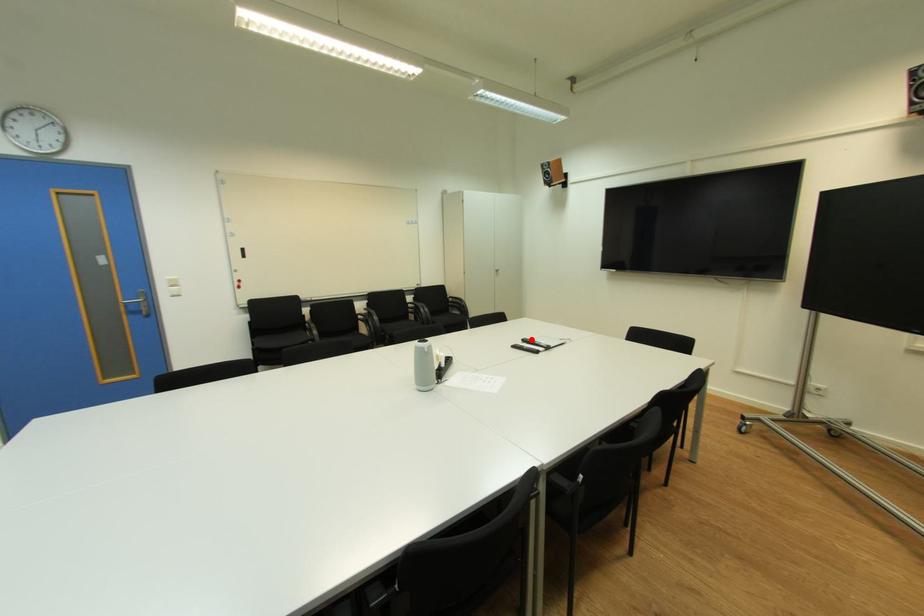
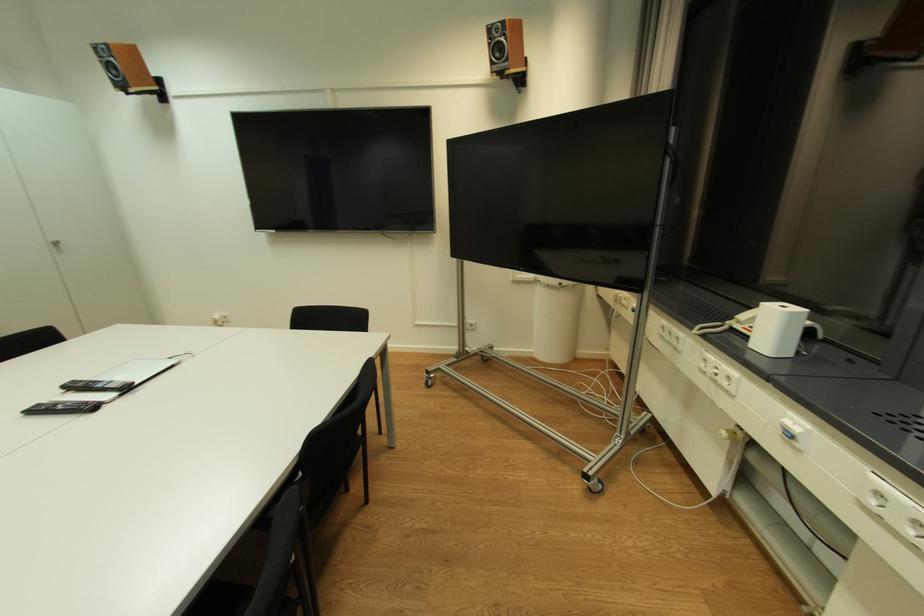
Locate, in the second image, the point that corresponds to the highlighted location in the first image.

(79, 383)